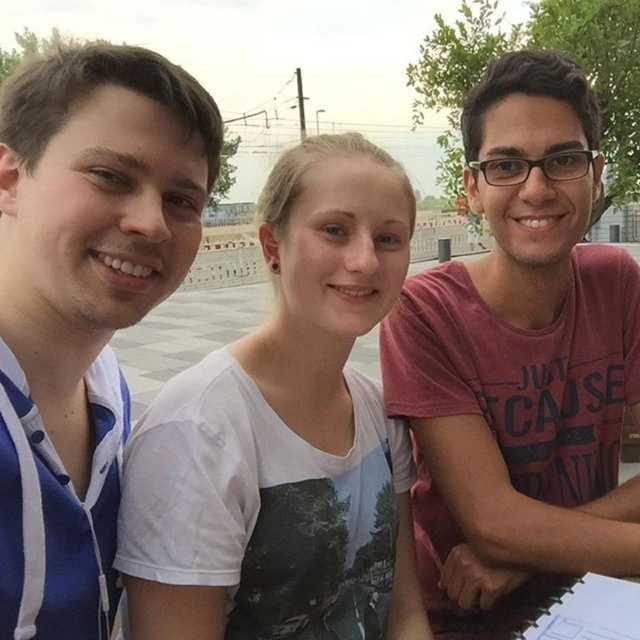
Who is positioned more to the left, pink cotton shirt at right or blue striped shirt at left?

blue striped shirt at left

Is the position of pink cotton shirt at right more distant than that of blue striped shirt at left?

Result: Yes, it is behind blue striped shirt at left.

Locate an element on the screen. The height and width of the screenshot is (640, 640). pink cotton shirt at right is located at coordinates (520, 355).

Describe the element at coordinates (285, 435) in the screenshot. The width and height of the screenshot is (640, 640). I see `white cotton t-shirt at center` at that location.

Can you confirm if white cotton t-shirt at center is positioned to the left of pink cotton shirt at right?

Indeed, white cotton t-shirt at center is positioned on the left side of pink cotton shirt at right.

Consider the image. Who is more forward, (x=230, y=394) or (x=536, y=464)?

Point (x=230, y=394)

I want to click on white cotton t-shirt at center, so click(x=285, y=435).

Can you confirm if white cotton t-shirt at center is positioned to the right of blue striped shirt at left?

Yes, white cotton t-shirt at center is to the right of blue striped shirt at left.

Is white cotton t-shirt at center smaller than blue striped shirt at left?

Incorrect, white cotton t-shirt at center is not smaller in size than blue striped shirt at left.

Does point (188, 560) come behind point (150, 76)?

Yes.

Where is `white cotton t-shirt at center`? white cotton t-shirt at center is located at coordinates (285, 435).